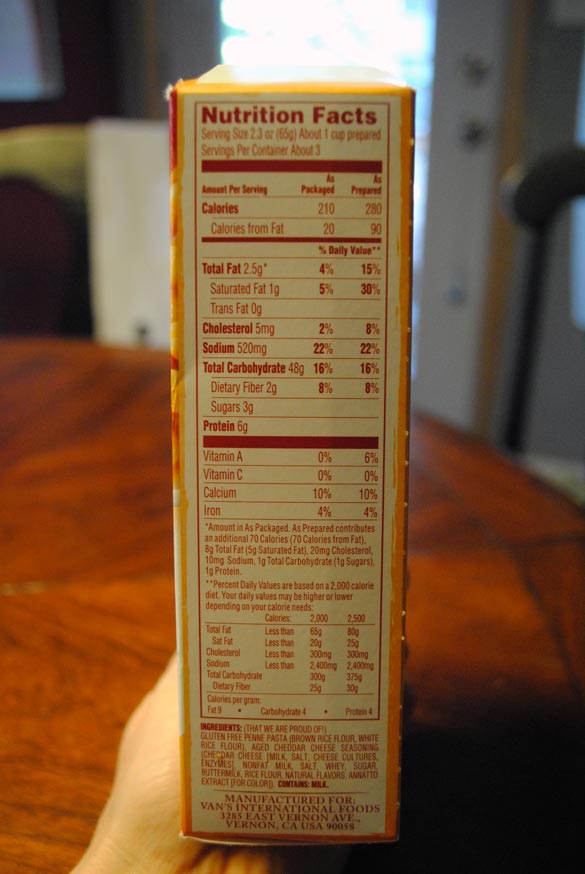
Where is `door frame`? The height and width of the screenshot is (874, 585). door frame is located at coordinates (454, 38), (441, 379).